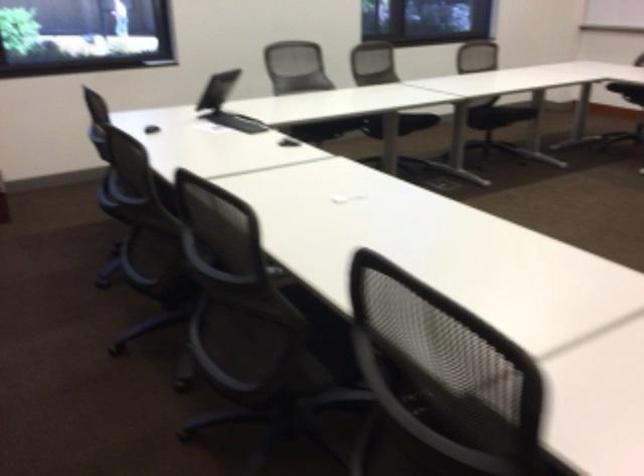
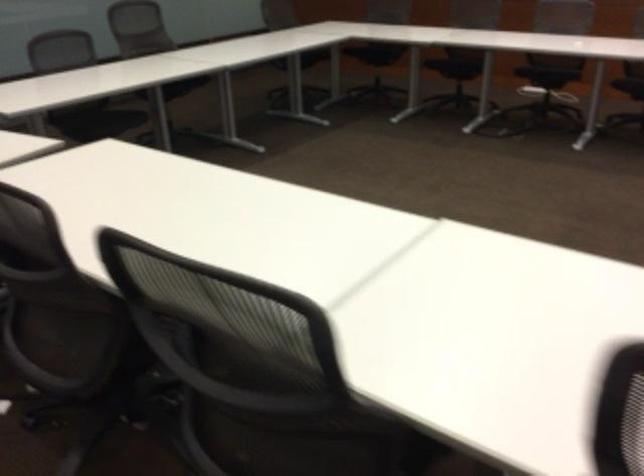
Question: The images are taken continuously from a first-person perspective. In which direction are you moving?

Choices:
 (A) Left
 (B) Right
 (C) Forward
 (D) Backward

Answer: (D)